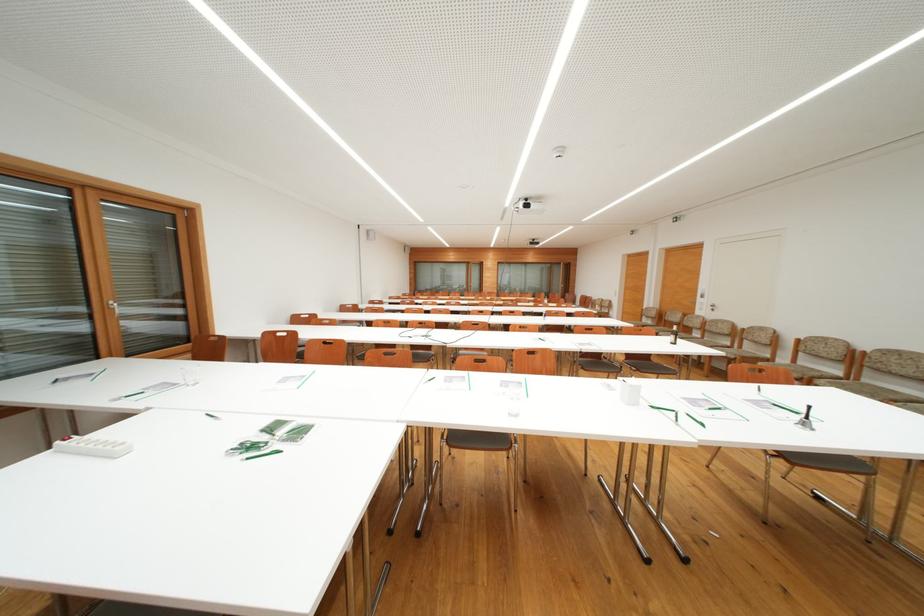
Locate an element on the screen. The image size is (924, 616). dark glass bottle is located at coordinates (806, 419).